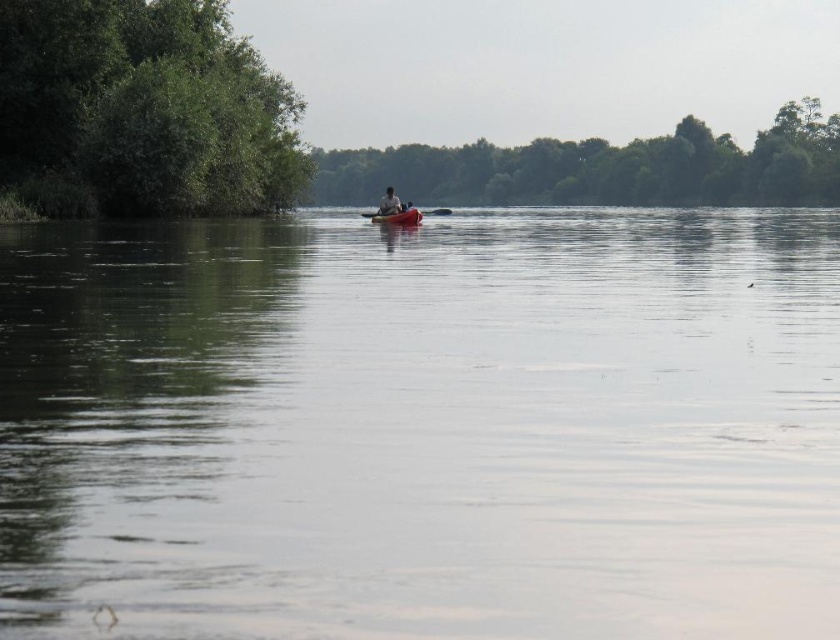
You are standing at the riverside and want to locate two points marked in the image. The first point is at coordinates point (591, 317) and the second is at point (392, 208). Which point is nearer to you?

Point (591, 317) is closer to the viewer than point (392, 208).

You are standing on the riverside and want to compare the height of the smooth water at center and the green leafy tree at center. Which one is taller?

The green leafy tree at center is taller than the smooth water at center.